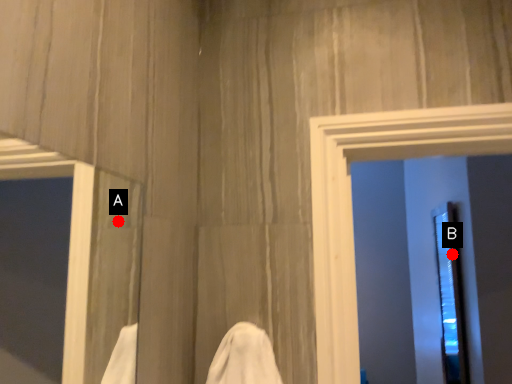
Question: Two points are circled on the image, labeled by A and B beside each circle. Which point is further to the camera?

Choices:
 (A) A is further
 (B) B is further

Answer: (B)